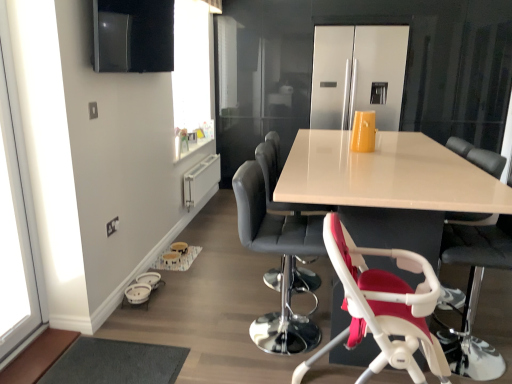
Question: From the image's perspective, would you say stainless steel refrigerator at center is positioned over white plastic baby carriage at lower left?

Choices:
 (A) no
 (B) yes

Answer: (B)

Question: Is stainless steel refrigerator at center oriented towards white plastic baby carriage at lower left?

Choices:
 (A) yes
 (B) no

Answer: (B)

Question: Is the position of stainless steel refrigerator at center more distant than that of white plastic baby carriage at lower left?

Choices:
 (A) no
 (B) yes

Answer: (B)

Question: Is stainless steel refrigerator at center at the right side of white plastic baby carriage at lower left?

Choices:
 (A) no
 (B) yes

Answer: (B)

Question: From a real-world perspective, is stainless steel refrigerator at center located higher than white plastic baby carriage at lower left?

Choices:
 (A) yes
 (B) no

Answer: (A)

Question: From a real-world perspective, is transparent glass window at left above or below white plastic baby carriage at lower left?

Choices:
 (A) below
 (B) above

Answer: (B)

Question: From the image's perspective, is transparent glass window at left positioned above or below white plastic baby carriage at lower left?

Choices:
 (A) below
 (B) above

Answer: (B)

Question: From their relative heights in the image, would you say transparent glass window at left is taller or shorter than white plastic baby carriage at lower left?

Choices:
 (A) short
 (B) tall

Answer: (B)

Question: Is point (18, 107) closer or farther from the camera than point (145, 281)?

Choices:
 (A) closer
 (B) farther

Answer: (A)

Question: From the image's perspective, relative to white plastic highchair at lower right, which is the 1th chair in front-to-back order, is white plastic baby carriage at lower left above or below?

Choices:
 (A) above
 (B) below

Answer: (B)

Question: Does point (153, 281) appear closer or farther from the camera than point (340, 249)?

Choices:
 (A) farther
 (B) closer

Answer: (A)

Question: Do you think white plastic baby carriage at lower left is within white plastic highchair at lower right, which is the 1th chair in front-to-back order, or outside of it?

Choices:
 (A) inside
 (B) outside

Answer: (B)

Question: Considering their positions, is white plastic baby carriage at lower left located in front of or behind white plastic highchair at lower right, which is the 1th chair in front-to-back order?

Choices:
 (A) front
 (B) behind

Answer: (B)

Question: In terms of size, does white plastic highchair at lower right, which ranks as the second chair in front-to-back order, appear bigger or smaller than transparent glass window at left?

Choices:
 (A) small
 (B) big

Answer: (B)

Question: Relative to transparent glass window at left, is white plastic highchair at lower right, which ranks as the second chair in front-to-back order, in front or behind?

Choices:
 (A) front
 (B) behind

Answer: (B)